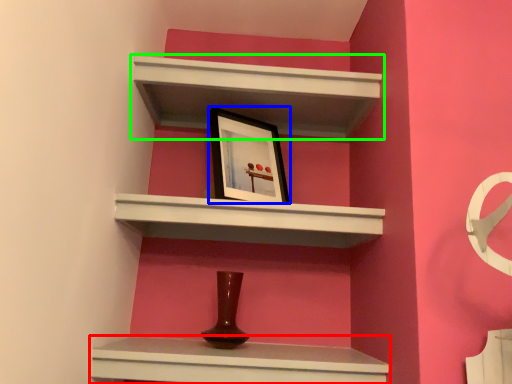
Question: Considering the real-world distances, which object is closest to shelf (highlighted by a red box)? picture frame (highlighted by a blue box) or shelf (highlighted by a green box).

Choices:
 (A) picture frame
 (B) shelf

Answer: (A)